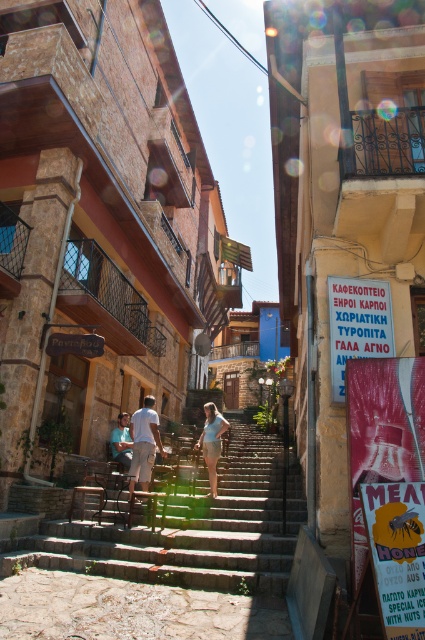
You are a tourist standing at the bottom of the stone steps in the Mediterranean town. You want to take a photo of the light brown shorts at center and the light blue shirt at center. In the photo, which object should be positioned to the right side?

The light brown shorts at center should be positioned to the right side of the light blue shirt at center because the light brown shorts at center is to the right of light blue shirt at center according to the description.

You are standing on the stone steps in the Mediterranean town and notice a person wearing light brown shorts at center and light blue shirt at center. Which piece of clothing is closer to you?

The light brown shorts at center is closer to the viewer than the light blue shirt at center.